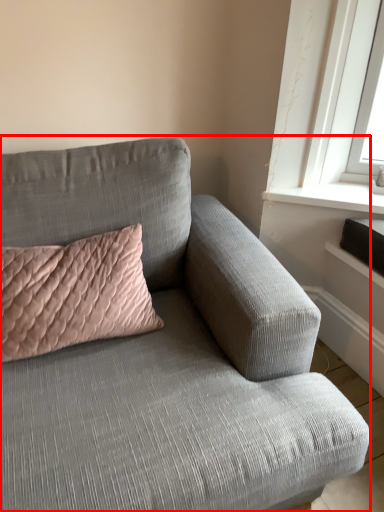
Question: From the image's perspective, where is studio couch (annotated by the red box) located relative to pillow?

Choices:
 (A) below
 (B) above

Answer: (A)